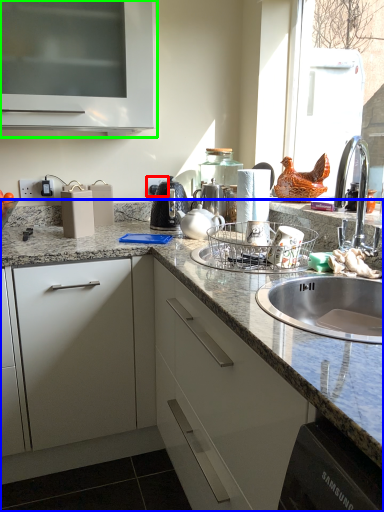
Question: Which object is the closest to the electric outlet (highlighted by a red box)? Choose among these: countertop (highlighted by a blue box) or cabinetry (highlighted by a green box).

Choices:
 (A) countertop
 (B) cabinetry

Answer: (B)